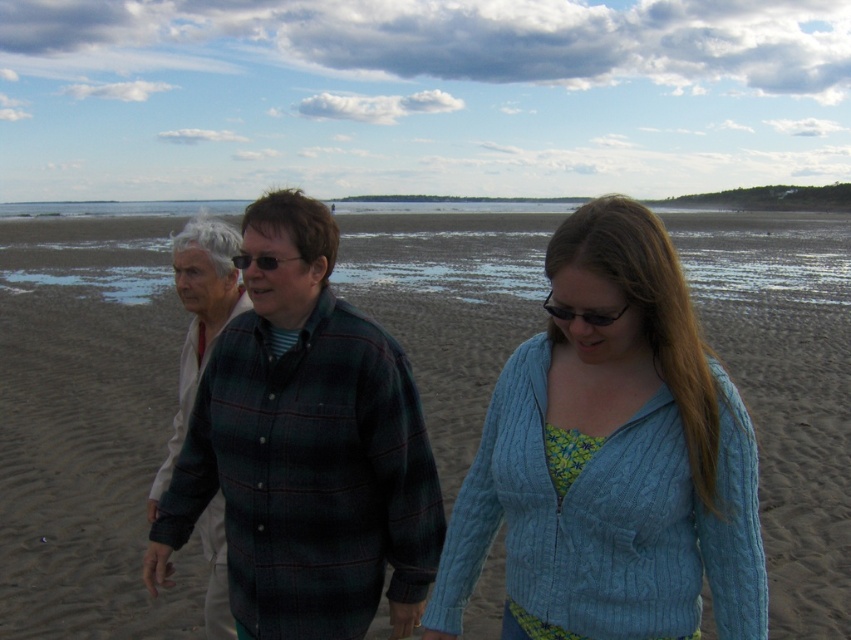
How far apart are green plaid shirt at center and plaid flannel shirt at center?

green plaid shirt at center and plaid flannel shirt at center are 27.76 inches apart from each other.

Is point (252, 506) positioned after point (180, 397)?

No.

Find the location of a particular element. This screenshot has width=851, height=640. green plaid shirt at center is located at coordinates (306, 451).

What do you see at coordinates (86, 426) in the screenshot? I see `brown sandy beach at center` at bounding box center [86, 426].

Is brown sandy beach at center in front of black plastic sunglasses at center?

No, it is not.

Is point (21, 476) positioned before point (256, 257)?

No, it is not.

At what (x,y) coordinates should I click in order to perform the action: click on brown sandy beach at center. Please return your answer as a coordinate pair (x, y). Looking at the image, I should click on click(86, 426).

Does green plaid shirt at center appear on the right side of black plastic sunglasses at center?

Correct, you'll find green plaid shirt at center to the right of black plastic sunglasses at center.

Is green plaid shirt at center taller than black plastic sunglasses at center?

Correct, green plaid shirt at center is much taller as black plastic sunglasses at center.

Find the location of a particular element. The image size is (851, 640). green plaid shirt at center is located at coordinates (306, 451).